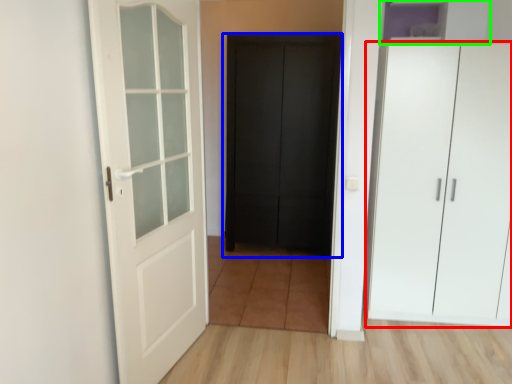
Question: Estimate the real-world distances between objects in this image. Which object is farther from cupboard (highlighted by a red box), door (highlighted by a blue box) or cabinetry (highlighted by a green box)?

Choices:
 (A) door
 (B) cabinetry

Answer: (A)